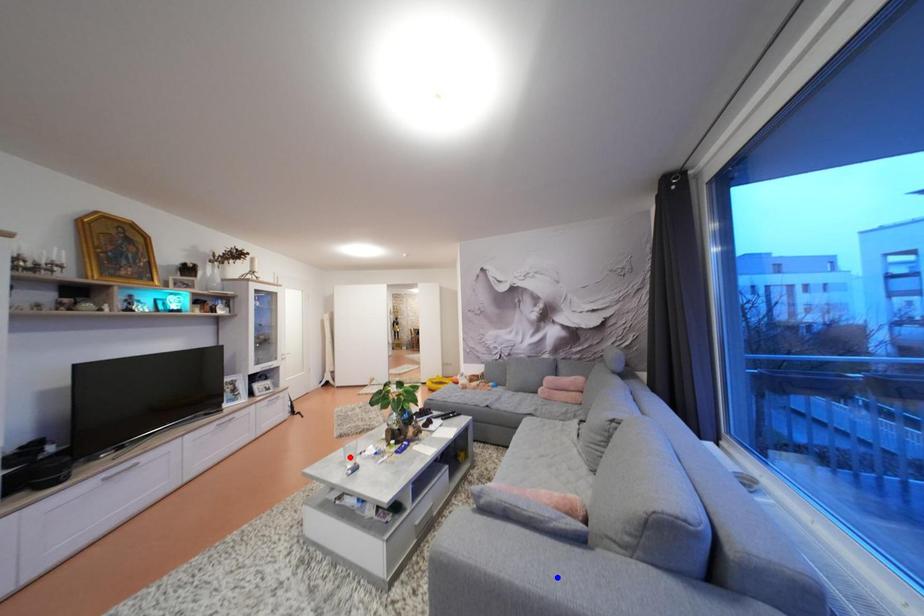
Question: Which of the two points in the image is closer to the camera?

Choices:
 (A) Blue point is closer.
 (B) Red point is closer.

Answer: (A)